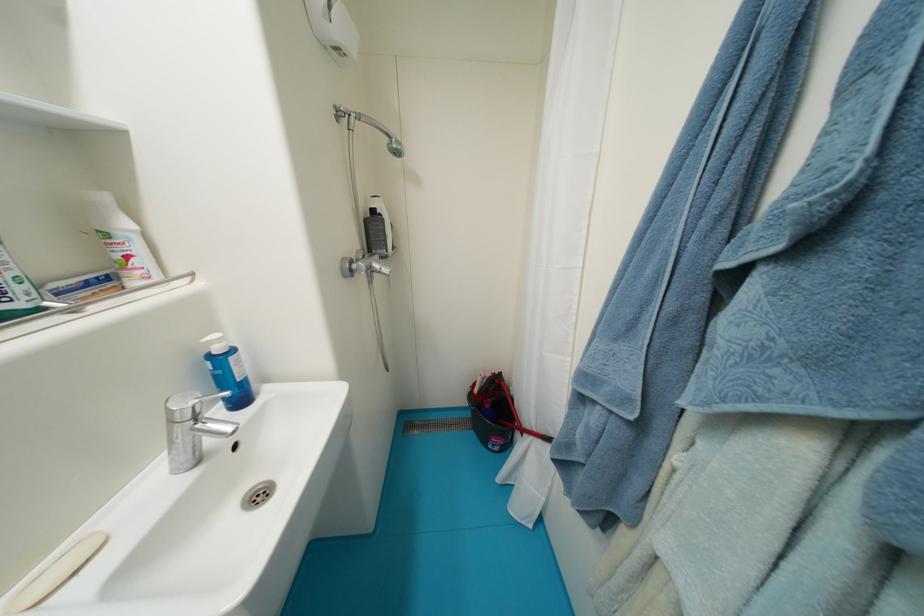
In order to click on white shower curtain in this screenshot , I will do `click(558, 236)`.